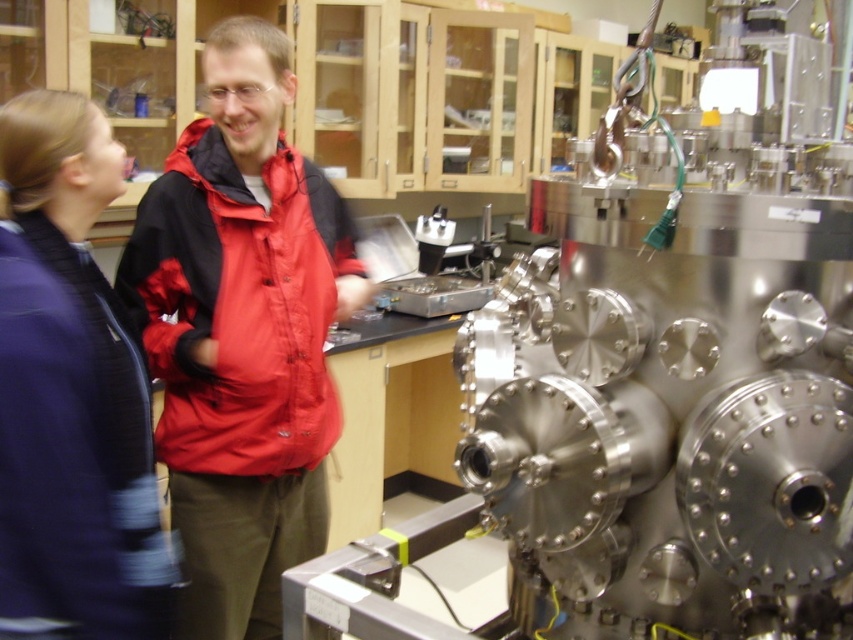
What do you see at coordinates (70, 394) in the screenshot? The width and height of the screenshot is (853, 640). I see `blue fabric jacket at left` at bounding box center [70, 394].

At what (x,y) coordinates should I click in order to perform the action: click on blue fabric jacket at left. Please return your answer as a coordinate pair (x, y). Image resolution: width=853 pixels, height=640 pixels. Looking at the image, I should click on (70, 394).

Find the location of a particular element. The width and height of the screenshot is (853, 640). blue fabric jacket at left is located at coordinates (70, 394).

In the scene shown: Is red matte jacket at center shorter than blue fabric jacket at left?

No.

Who is more distant from viewer, (247, 577) or (96, 556)?

The point (247, 577) is behind.

Identify the location of red matte jacket at center. This screenshot has width=853, height=640. (242, 333).

Can you confirm if red matte jacket at center is positioned above red nylon jacket at center?

No.

Is red matte jacket at center further to camera compared to red nylon jacket at center?

No, red matte jacket at center is closer to the viewer.

You are a GUI agent. You are given a task and a screenshot of the screen. Output one action in this format:
    pyautogui.click(x=<x>, y=<y>)
    Task: Click on the red matte jacket at center
    
    Given the screenshot: What is the action you would take?
    pyautogui.click(x=242, y=333)